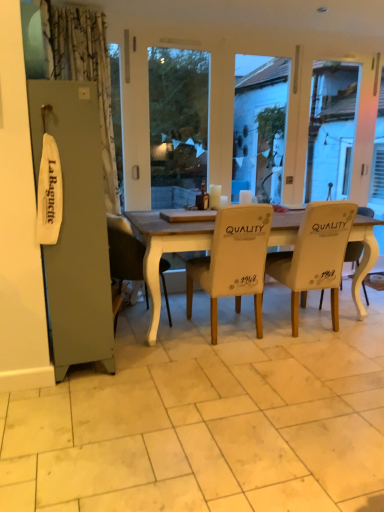
Question: Does white fabric chair at right, arranged as the first chair when viewed from the right, have a greater height compared to white leather chair at center, the 3th chair viewed from the right?

Choices:
 (A) yes
 (B) no

Answer: (B)

Question: From the image's perspective, is white fabric chair at right, positioned as the fourth chair in left-to-right order, under white leather chair at center, the 2th chair positioned from the left?

Choices:
 (A) yes
 (B) no

Answer: (B)

Question: Can you confirm if white fabric chair at right, arranged as the first chair when viewed from the right, is positioned to the left of white leather chair at center, the 2th chair positioned from the left?

Choices:
 (A) yes
 (B) no

Answer: (B)

Question: From a real-world perspective, is white fabric chair at right, arranged as the first chair when viewed from the right, located beneath white leather chair at center, the 3th chair viewed from the right?

Choices:
 (A) no
 (B) yes

Answer: (B)

Question: Is white fabric chair at right, positioned as the fourth chair in left-to-right order, positioned behind white leather chair at center, the 2th chair positioned from the left?

Choices:
 (A) no
 (B) yes

Answer: (B)

Question: Is white fabric chair at right, arranged as the first chair when viewed from the right, positioned with its back to white leather chair at center, the 3th chair viewed from the right?

Choices:
 (A) yes
 (B) no

Answer: (B)

Question: Does white tile at center turn towards white fabric chair at center, placed as the 3th chair when sorted from left to right?

Choices:
 (A) no
 (B) yes

Answer: (A)

Question: Can white fabric chair at center, placed as the 3th chair when sorted from left to right, be found inside white tile at center?

Choices:
 (A) yes
 (B) no

Answer: (B)

Question: Can you confirm if white tile at center is shorter than white fabric chair at center, placed as the 3th chair when sorted from left to right?

Choices:
 (A) no
 (B) yes

Answer: (B)

Question: Is white tile at center with white fabric chair at center, which ranks as the 2th chair in right-to-left order?

Choices:
 (A) yes
 (B) no

Answer: (B)

Question: From the image's perspective, is white tile at center on top of white fabric chair at center, placed as the 3th chair when sorted from left to right?

Choices:
 (A) yes
 (B) no

Answer: (B)

Question: Is white tile at center positioned with its back to white fabric chair at center, placed as the 3th chair when sorted from left to right?

Choices:
 (A) yes
 (B) no

Answer: (B)

Question: Does white fabric chair at right, positioned as the fourth chair in left-to-right order, lie in front of white fabric chair at center, acting as the 1th chair starting from the left?

Choices:
 (A) yes
 (B) no

Answer: (B)